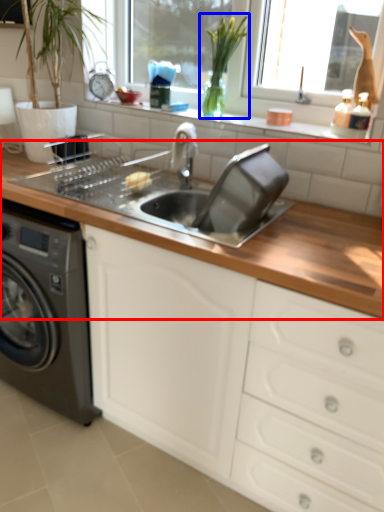
Question: Which point is closer to the camera, countertop (highlighted by a red box) or plant (highlighted by a blue box)?

Choices:
 (A) countertop
 (B) plant

Answer: (A)